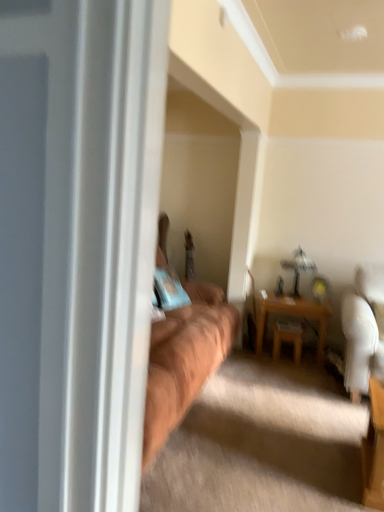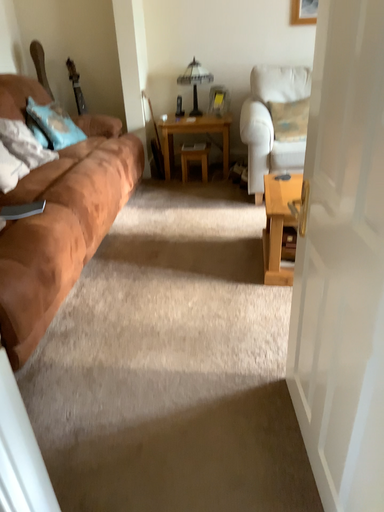
Question: Which way did the camera rotate in the video?

Choices:
 (A) rotated upward
 (B) rotated downward

Answer: (B)